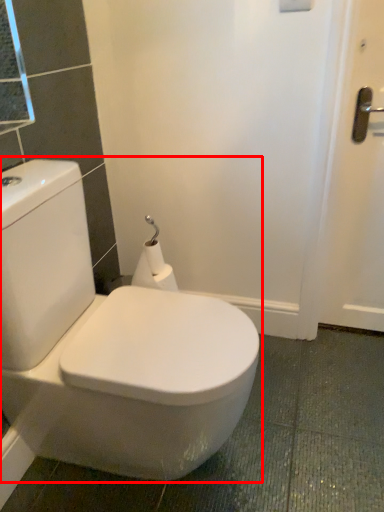
Question: From the image's perspective, considering the relative positions of toilet (annotated by the red box) and toilet paper in the image provided, where is toilet (annotated by the red box) located with respect to the staircase?

Choices:
 (A) above
 (B) below

Answer: (B)